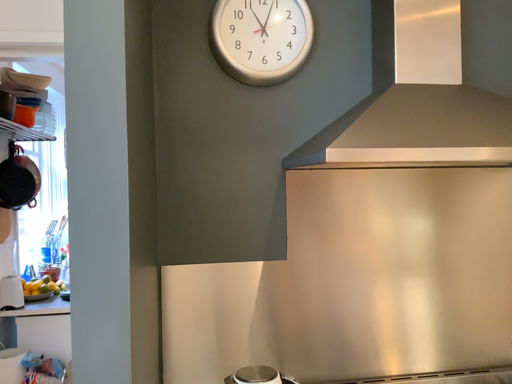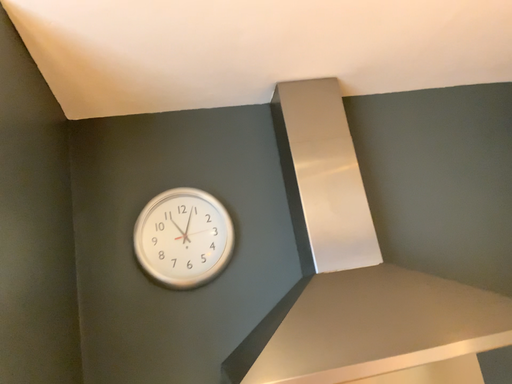
Question: Which way did the camera rotate in the video?

Choices:
 (A) rotated downward
 (B) rotated upward

Answer: (B)